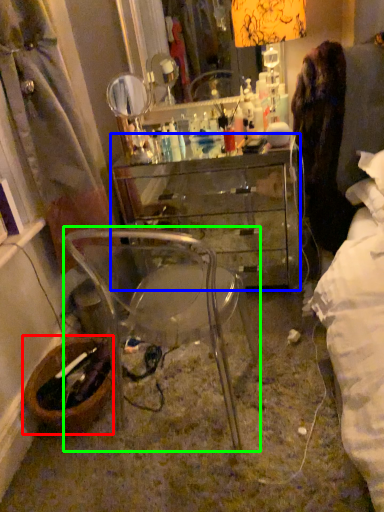
Question: Which object is the closest to the picnic basket (highlighted by a red box)? Choose among these: desk (highlighted by a blue box) or chair (highlighted by a green box).

Choices:
 (A) desk
 (B) chair

Answer: (B)